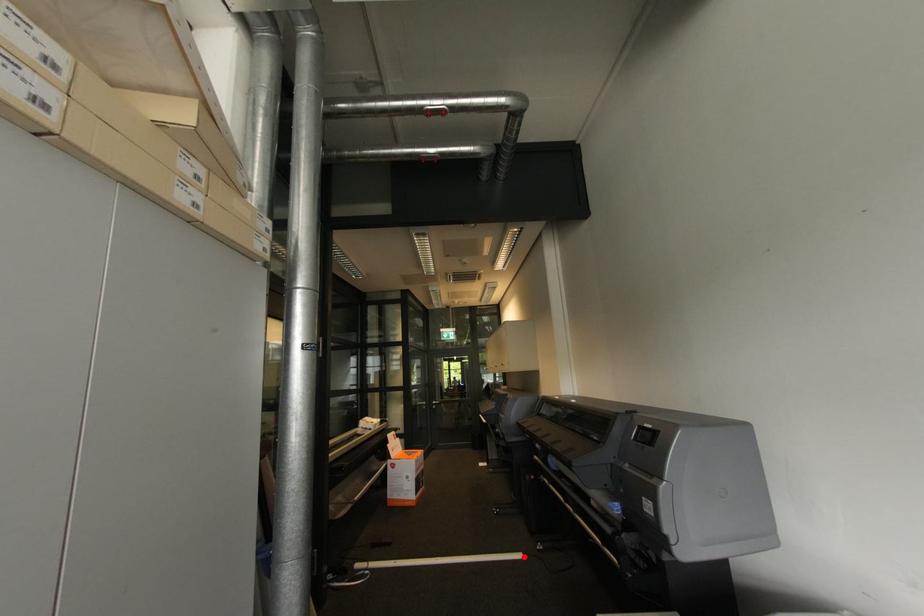
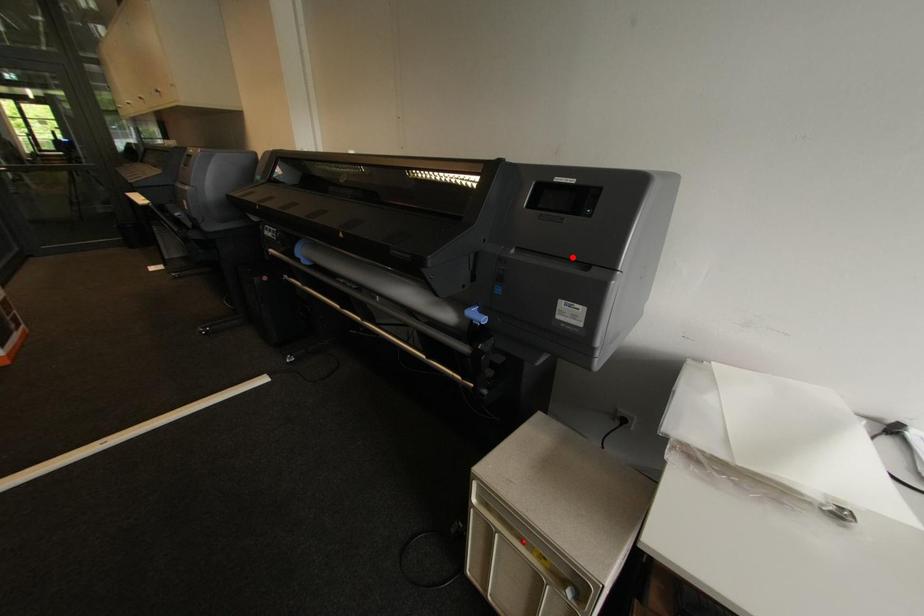
I am providing you with two images of the same scene from different viewpoints. A red point is marked on the first image and another point is marked on the second image. Are the points marked in image1 and image2 representing the same 3D position?

No